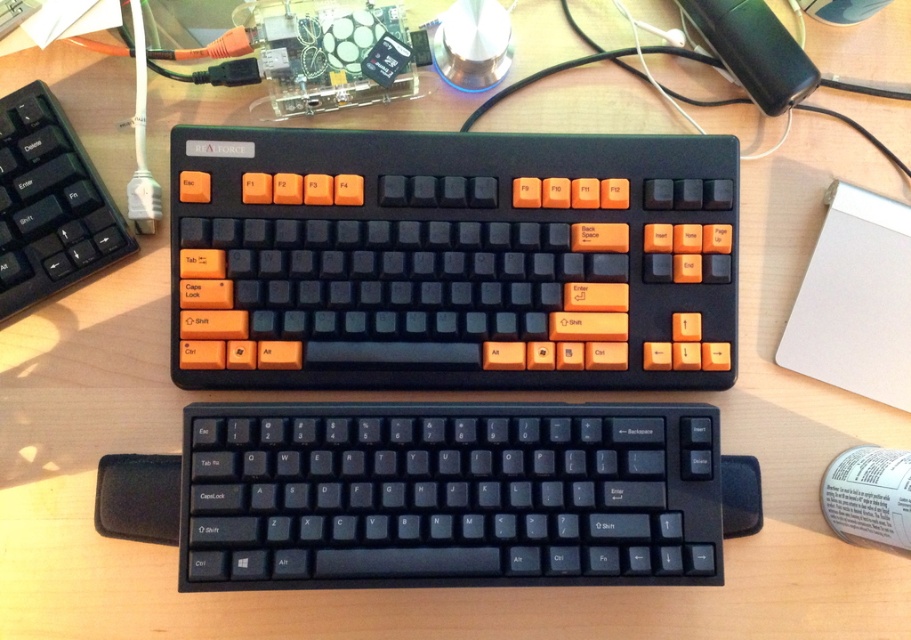
You are a photographer trying to capture a closeup of the keyboard in the foreground. You notice two points marked on your viewfinder at coordinates point (330, 456) and point (62, 284). Which point should you focus on to ensure the foreground keyboard is in sharp focus?

You should focus on point (330, 456) because it is closer to the camera than point (62, 284), which aligns with the foreground keyboard.

You are standing in front of a desk with two mechanical keyboards. You need to place a new mouse on the desk such that it is exactly at point [451,259]. Which keyboard should you place the mouse on?

The matte black keyboard at center is located at point [451,259], so you should place the mouse on the matte black keyboard at center.